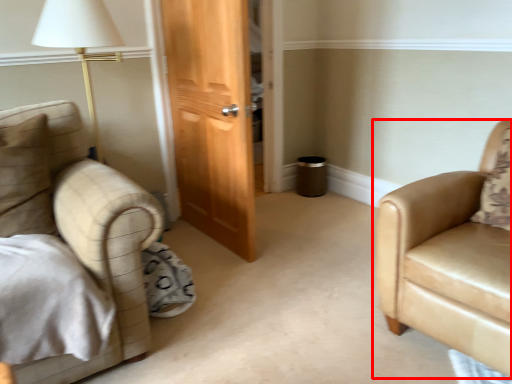
Question: From the image's perspective, considering the relative positions of chair (annotated by the red box) and pillow in the image provided, where is chair (annotated by the red box) located with respect to the staircase?

Choices:
 (A) below
 (B) above

Answer: (A)